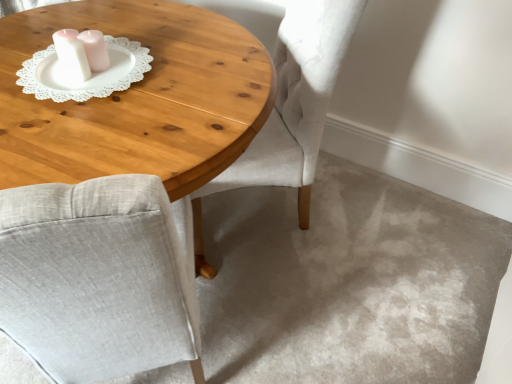
The height and width of the screenshot is (384, 512). I want to click on free space to the left of white lace doily at upper left, so click(x=18, y=65).